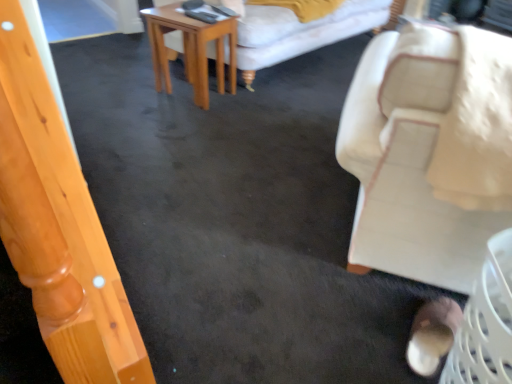
Describe the element at coordinates (192, 50) in the screenshot. The height and width of the screenshot is (384, 512). I see `light brown wooden table at center` at that location.

Find the location of a particular element. This screenshot has width=512, height=384. brown suede shoe at lower right is located at coordinates (432, 335).

Based on the photo, is light brown wooden table at center inside beige fabric chair at right?

No, light brown wooden table at center is not inside beige fabric chair at right.

Is beige fabric chair at right in front of light brown wooden table at center?

Yes, it is.

Does beige fabric chair at right turn towards light brown wooden table at center?

No, beige fabric chair at right is not turned towards light brown wooden table at center.

Is point (436, 29) positioned before point (185, 25)?

Yes, it is in front of point (185, 25).

What's the angular difference between light brown wooden table at center and brown suede shoe at lower right's facing directions?

They differ by 88.3 degrees in their facing directions.

Is light brown wooden table at center facing away from brown suede shoe at lower right?

No, light brown wooden table at center is not facing the opposite direction of brown suede shoe at lower right.

Considering the sizes of objects light brown wooden table at center and brown suede shoe at lower right in the image provided, who is smaller, light brown wooden table at center or brown suede shoe at lower right?

With smaller size is brown suede shoe at lower right.

Does light brown wooden table at center touch brown suede shoe at lower right?

No, light brown wooden table at center is not in contact with brown suede shoe at lower right.

Looking at this image, from their relative heights in the image, would you say brown suede shoe at lower right is taller or shorter than light brown wooden table at center?

Clearly, brown suede shoe at lower right is shorter compared to light brown wooden table at center.

From the image's perspective, which is below, brown suede shoe at lower right or light brown wooden table at center?

brown suede shoe at lower right.

Is brown suede shoe at lower right not within light brown wooden table at center?

Yes, brown suede shoe at lower right is outside of light brown wooden table at center.

Considering the relative positions of brown suede shoe at lower right and light brown wooden table at center in the image provided, is brown suede shoe at lower right behind light brown wooden table at center?

No, brown suede shoe at lower right is closer to the camera.

Is brown suede shoe at lower right looking in the opposite direction of beige fabric chair at right?

No, beige fabric chair at right is not at the back of brown suede shoe at lower right.

Considering the relative sizes of brown suede shoe at lower right and beige fabric chair at right in the image provided, is brown suede shoe at lower right smaller than beige fabric chair at right?

Correct, brown suede shoe at lower right occupies less space than beige fabric chair at right.

Find the location of a particular element. Image resolution: width=512 pixels, height=384 pixels. chair lying in front of the brown suede shoe at lower right is located at coordinates (408, 162).

Which of these two, beige fabric chair at right or brown suede shoe at lower right, is bigger?

With larger size is beige fabric chair at right.

From the image's perspective, is beige fabric chair at right under brown suede shoe at lower right?

Actually, beige fabric chair at right appears above brown suede shoe at lower right in the image.

Who is shorter, beige fabric chair at right or brown suede shoe at lower right?

With less height is brown suede shoe at lower right.

From the image's perspective, is light brown wooden table at center on top of beige fabric chair at right?

Indeed, from the image's perspective, light brown wooden table at center is shown above beige fabric chair at right.

Image resolution: width=512 pixels, height=384 pixels. Find the location of `chair below the light brown wooden table at center (from the image's perspective)`. chair below the light brown wooden table at center (from the image's perspective) is located at coordinates (408, 162).

Are light brown wooden table at center and beige fabric chair at right far apart?

Yes.

Does light brown wooden table at center have a larger size compared to beige fabric chair at right?

No.

The height and width of the screenshot is (384, 512). What are the coordinates of `table behind the beige fabric chair at right` in the screenshot? It's located at [x=192, y=50].

You are a GUI agent. You are given a task and a screenshot of the screen. Output one action in this format:
    pyautogui.click(x=<x>, y=<y>)
    Task: Click on the footwear located below the light brown wooden table at center (from the image's perspective)
    
    Given the screenshot: What is the action you would take?
    pyautogui.click(x=432, y=335)

Which object lies nearer to the anchor point brown suede shoe at lower right, beige fabric chair at right or light brown wooden table at center?

beige fabric chair at right is positioned closer to the anchor brown suede shoe at lower right.

In the scene shown: Which object lies nearer to the anchor point light brown wooden table at center, beige fabric chair at right or brown suede shoe at lower right?

beige fabric chair at right lies closer to light brown wooden table at center than the other object.

From the image, which object appears to be nearer to brown suede shoe at lower right, light brown wooden table at center or beige fabric chair at right?

Among the two, beige fabric chair at right is located nearer to brown suede shoe at lower right.

Estimate the real-world distances between objects in this image. Which object is further from beige fabric chair at right, brown suede shoe at lower right or light brown wooden table at center?

light brown wooden table at center is positioned further to the anchor beige fabric chair at right.

When comparing their distances from light brown wooden table at center, does brown suede shoe at lower right or beige fabric chair at right seem closer?

The object closer to light brown wooden table at center is beige fabric chair at right.

Which object lies further to the anchor point beige fabric chair at right, light brown wooden table at center or brown suede shoe at lower right?

The object further to beige fabric chair at right is light brown wooden table at center.

Identify the location of footwear between beige fabric chair at right and light brown wooden table at center along the z-axis. The width and height of the screenshot is (512, 384). pos(432,335).